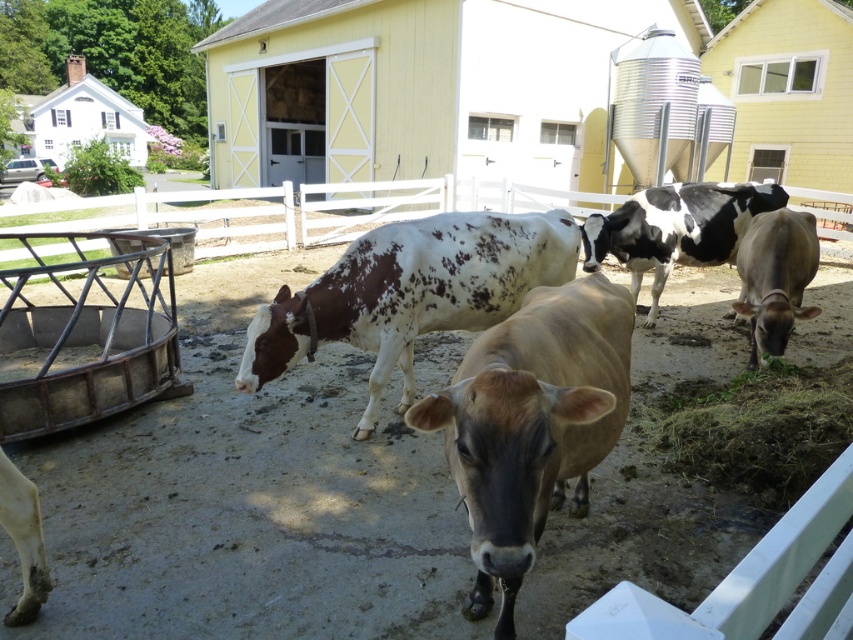
Question: Does black and white spotted cow at center appear on the left side of white painted wood barn at upper left?

Choices:
 (A) yes
 (B) no

Answer: (B)

Question: Which point is farther to the camera?

Choices:
 (A) (498, 476)
 (B) (602, 221)

Answer: (B)

Question: Among these objects, which one is farthest from the camera?

Choices:
 (A) brown smooth cow at right
 (B) speckled white cow at center
 (C) black and white spotted cow at center
 (D) white painted wood barn at upper left

Answer: (D)

Question: Which of the following is the closest to the observer?

Choices:
 (A) (82, 136)
 (B) (766, 228)
 (C) (366, 278)

Answer: (C)

Question: Does speckled white cow at center appear on the right side of black and white spotted cow at center?

Choices:
 (A) no
 (B) yes

Answer: (A)

Question: Does brown glossy cow at center have a larger size compared to speckled white cow at center?

Choices:
 (A) yes
 (B) no

Answer: (B)